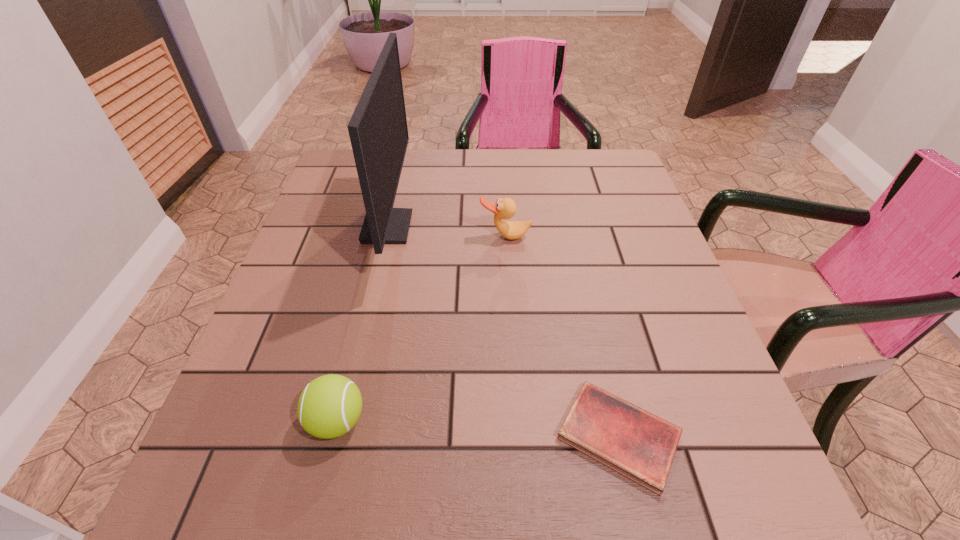
Where is `vacant position at the far left corner of the desktop`? vacant position at the far left corner of the desktop is located at coordinates (355, 190).

Find the location of a particular element. This screenshot has height=540, width=960. free region at the far right corner is located at coordinates pos(608,157).

Where is `vacant space at the near right corner`? vacant space at the near right corner is located at coordinates (743, 476).

Find the location of a particular element. free spot between the tallest object and the shortest object is located at coordinates (503, 331).

Find the location of a particular element. Image resolution: width=960 pixels, height=540 pixels. vacant area that lies between the third object from left to right and the tennis ball is located at coordinates (421, 329).

The height and width of the screenshot is (540, 960). I want to click on empty space that is in between the computer monitor and the duck, so [x=446, y=232].

The height and width of the screenshot is (540, 960). What are the coordinates of `vacant space that is in between the tennis ball and the tallest object` in the screenshot? It's located at (362, 324).

In order to click on empty location between the rightmost object and the second object from right to left in this screenshot , I will do `click(562, 336)`.

Find the location of a particular element. The width and height of the screenshot is (960, 540). vacant space that's between the tallest object and the shortest object is located at coordinates (503, 331).

At what (x,y) coordinates should I click in order to perform the action: click on unoccupied position between the tallest object and the rightmost object. Please return your answer as a coordinate pair (x, y). This screenshot has width=960, height=540. Looking at the image, I should click on (503, 331).